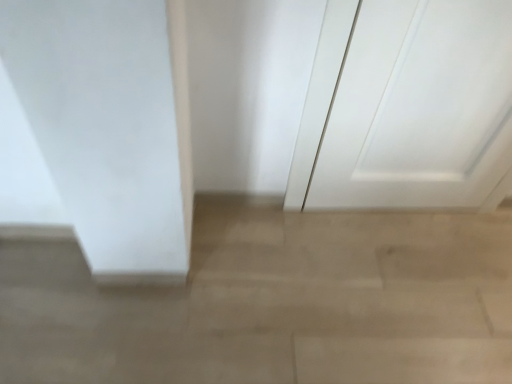
This screenshot has height=384, width=512. Identify the location of vacant space in front of white matte door at upper right. (395, 288).